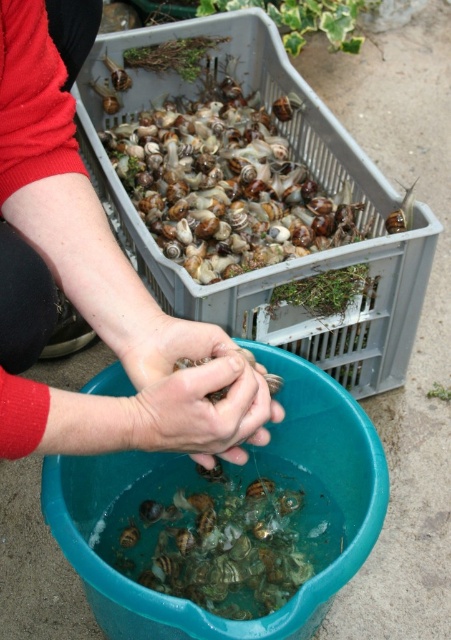
Is smooth skin hands at center smaller than translucent plastic snails at lower center?

No, smooth skin hands at center is not smaller than translucent plastic snails at lower center.

How far apart are smooth skin hands at center and translucent plastic snails at lower center?

17.63 inches

Does point (101, 292) lie in front of point (302, 563)?

Yes, point (101, 292) is in front of point (302, 563).

Where is `smooth skin hands at center`? smooth skin hands at center is located at coordinates (96, 291).

Can you confirm if translucent plastic crate at upper center is thinner than translucent plastic snails at lower center?

No, translucent plastic crate at upper center is not thinner than translucent plastic snails at lower center.

Is point (228, 188) behind point (240, 586)?

Yes, it is.

Is point (138, 166) more distant than point (210, 598)?

Yes, it is.

Find the location of a particular element. Image resolution: width=451 pixels, height=640 pixels. translucent plastic crate at upper center is located at coordinates (x=225, y=182).

Which is below, smooth skin hands at center or translucent plastic crate at upper center?

Positioned lower is smooth skin hands at center.

Describe the element at coordinates (96, 291) in the screenshot. The height and width of the screenshot is (640, 451). I see `smooth skin hands at center` at that location.

Locate an element on the screen. smooth skin hands at center is located at coordinates [96, 291].